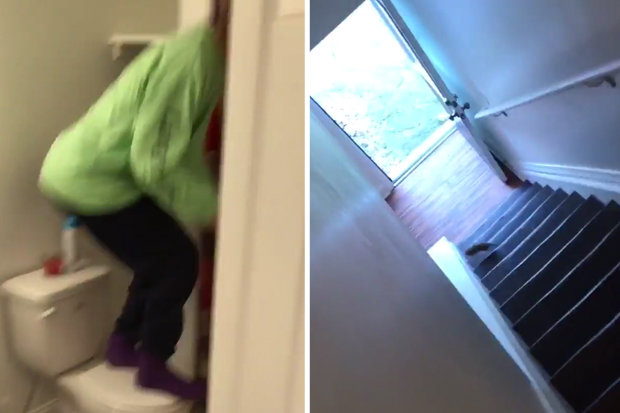
In order to click on walls in this screenshot , I will do `click(433, 377)`, `click(563, 137)`.